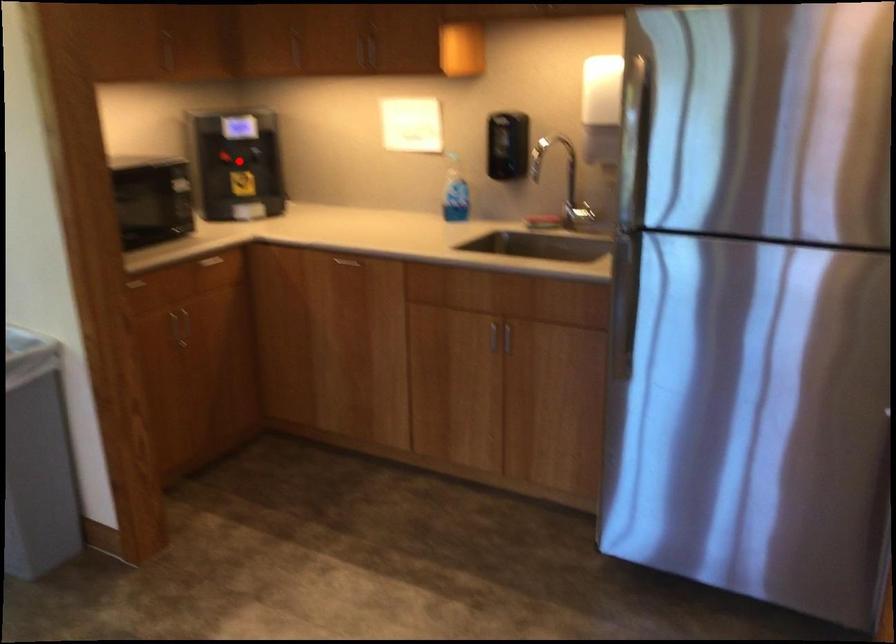
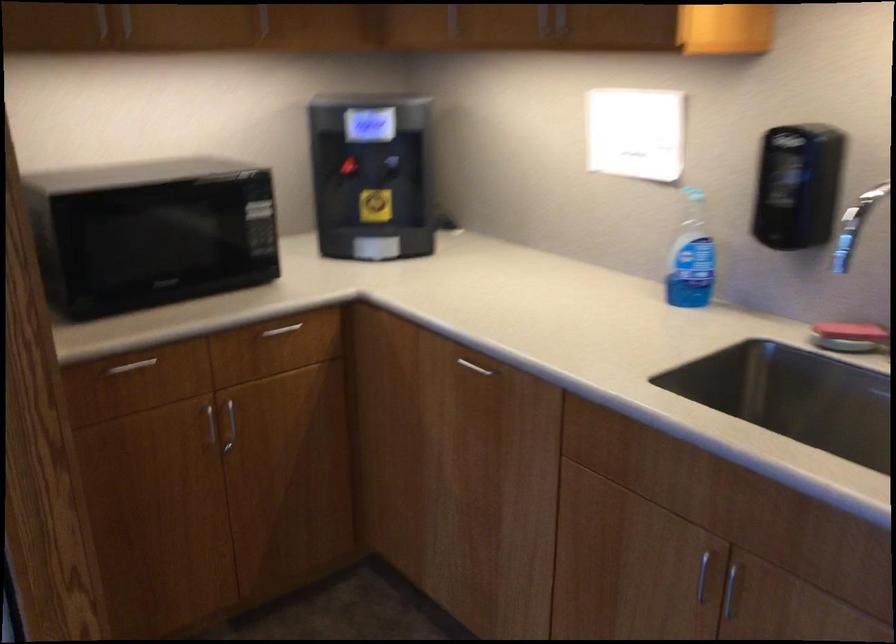
Find the pixel in the second image that matches the highlighted location in the first image.

(372, 176)